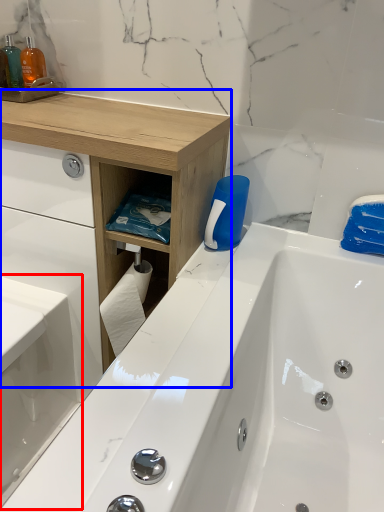
Question: Which object appears farthest to the camera in this image, sink (highlighted by a red box) or counter (highlighted by a blue box)?

Choices:
 (A) sink
 (B) counter

Answer: (B)